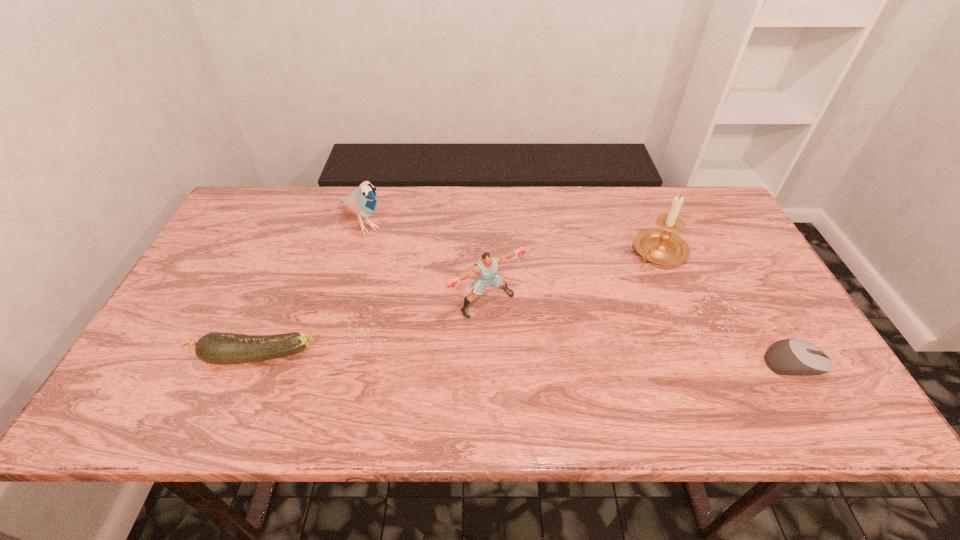
Find the location of a particular element. vacant space positioned with a handle on the side of the candle holder is located at coordinates click(617, 294).

Where is `free spot located 0.370m at the face of the bird`? free spot located 0.370m at the face of the bird is located at coordinates (451, 319).

Locate an element on the screen. The height and width of the screenshot is (540, 960). vacant point located at the face of the bird is located at coordinates (431, 298).

Locate an element on the screen. This screenshot has height=540, width=960. free space located 0.140m at the face of the bird is located at coordinates (402, 268).

Identify the location of free space located 0.140m on the front-facing side of the puncher. The image size is (960, 540). (543, 360).

Locate an element on the screen. Image resolution: width=960 pixels, height=540 pixels. free region located on the front-facing side of the puncher is located at coordinates (564, 383).

At what (x,y) coordinates should I click in order to perform the action: click on candle holder that is at the far edge. Please return your answer as a coordinate pair (x, y). The width and height of the screenshot is (960, 540). Looking at the image, I should click on (660, 246).

The image size is (960, 540). In order to click on bird at the far edge in this screenshot , I will do `click(362, 201)`.

You are a GUI agent. You are given a task and a screenshot of the screen. Output one action in this format:
    pyautogui.click(x=<x>, y=<y>)
    Task: Click on the zucchini situated at the near edge
    
    Given the screenshot: What is the action you would take?
    pyautogui.click(x=218, y=348)

In order to click on computer equipment situated at the near edge in this screenshot , I will do `click(794, 357)`.